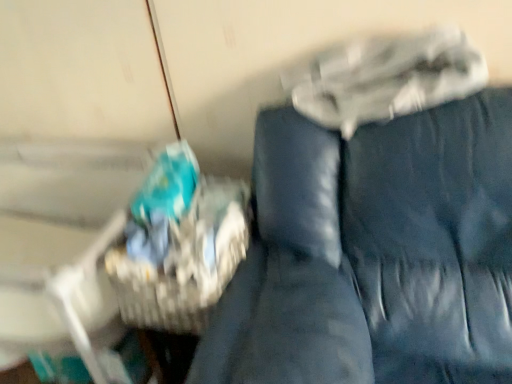
What do you see at coordinates (186, 261) in the screenshot? I see `woven brown basket at left` at bounding box center [186, 261].

Locate an element on the screen. Image resolution: width=512 pixels, height=384 pixels. woven brown basket at left is located at coordinates [186, 261].

At what (x,y) coordinates should I click in order to perform the action: click on blue fabric couch at center. Please return your answer as a coordinate pair (x, y). This screenshot has width=512, height=384. Looking at the image, I should click on (374, 254).

What do you see at coordinates (374, 254) in the screenshot?
I see `blue fabric couch at center` at bounding box center [374, 254].

The width and height of the screenshot is (512, 384). Find the location of `woven brown basket at left`. woven brown basket at left is located at coordinates (186, 261).

Can you confirm if blue fabric couch at center is positioned to the left of woven brown basket at left?

Incorrect, blue fabric couch at center is not on the left side of woven brown basket at left.

Is blue fabric couch at center positioned behind woven brown basket at left?

No, the depth of blue fabric couch at center is less than that of woven brown basket at left.

Considering the positions of points (459, 258) and (179, 298), is point (459, 258) closer to camera compared to point (179, 298)?

No, it is not.

From the image's perspective, is blue fabric couch at center above or below woven brown basket at left?

blue fabric couch at center is below woven brown basket at left.

From a real-world perspective, which object stands above the other?

woven brown basket at left.

Can you confirm if blue fabric couch at center is wider than woven brown basket at left?

Yes.

Considering the relative sizes of blue fabric couch at center and woven brown basket at left in the image provided, is blue fabric couch at center shorter than woven brown basket at left?

No, blue fabric couch at center is not shorter than woven brown basket at left.

In terms of size, does blue fabric couch at center appear bigger or smaller than woven brown basket at left?

In the image, blue fabric couch at center appears to be larger than woven brown basket at left.

Is blue fabric couch at center not within woven brown basket at left?

Indeed, blue fabric couch at center is completely outside woven brown basket at left.

Consider the image. Is blue fabric couch at center directly adjacent to woven brown basket at left?

No.

In the scene shown: Is blue fabric couch at center oriented away from woven brown basket at left?

No.

How far apart are blue fabric couch at center and woven brown basket at left?

A distance of 10.53 inches exists between blue fabric couch at center and woven brown basket at left.

Image resolution: width=512 pixels, height=384 pixels. In order to click on basket behind the blue fabric couch at center in this screenshot , I will do `click(186, 261)`.

Is woven brown basket at left at the right side of blue fabric couch at center?

In fact, woven brown basket at left is to the left of blue fabric couch at center.

Does woven brown basket at left lie in front of blue fabric couch at center?

No, it is behind blue fabric couch at center.

Considering the points (231, 255) and (295, 375), which point is behind, point (231, 255) or point (295, 375)?

The point (231, 255) is behind.

From the image's perspective, between woven brown basket at left and blue fabric couch at center, which one is located above?

woven brown basket at left.

From a real-world perspective, which object stands above the other?

woven brown basket at left.

Considering the sizes of woven brown basket at left and blue fabric couch at center in the image, is woven brown basket at left wider or thinner than blue fabric couch at center?

Considering their sizes, woven brown basket at left looks slimmer than blue fabric couch at center.

Considering the sizes of woven brown basket at left and blue fabric couch at center in the image, is woven brown basket at left taller or shorter than blue fabric couch at center?

Considering their sizes, woven brown basket at left has less height than blue fabric couch at center.

From the picture: Does woven brown basket at left have a larger size compared to blue fabric couch at center?

No, woven brown basket at left is not bigger than blue fabric couch at center.

Choose the correct answer: Is woven brown basket at left inside blue fabric couch at center or outside it?

woven brown basket at left lies outside blue fabric couch at center.

Is woven brown basket at left placed right next to blue fabric couch at center?

No, woven brown basket at left is not in contact with blue fabric couch at center.

Does woven brown basket at left turn towards blue fabric couch at center?

No, woven brown basket at left is not oriented towards blue fabric couch at center.

How many degrees apart are the facing directions of woven brown basket at left and blue fabric couch at center?

woven brown basket at left and blue fabric couch at center are facing 0.53 degrees away from each other.

Where is `furniture below the woven brown basket at left (from a real-world perspective)`? This screenshot has height=384, width=512. furniture below the woven brown basket at left (from a real-world perspective) is located at coordinates (374, 254).

What are the coordinates of `furniture on the right of woven brown basket at left` in the screenshot? It's located at (374, 254).

Identify the location of furniture in front of the woven brown basket at left. The image size is (512, 384). (374, 254).